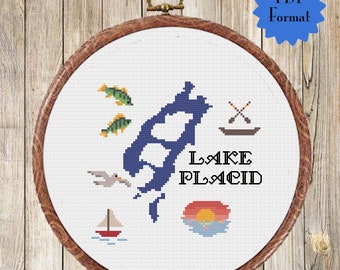
This screenshot has height=270, width=340. What are the coordinates of `embroidery hoop` in the screenshot? It's located at (252, 51).